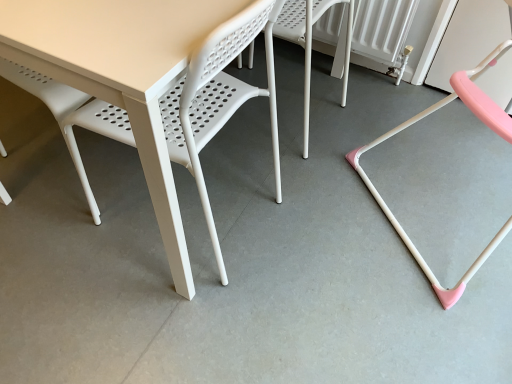
The width and height of the screenshot is (512, 384). I want to click on free space to the left of pink plastic chair at right, the first chair when ordered from right to left, so click(324, 220).